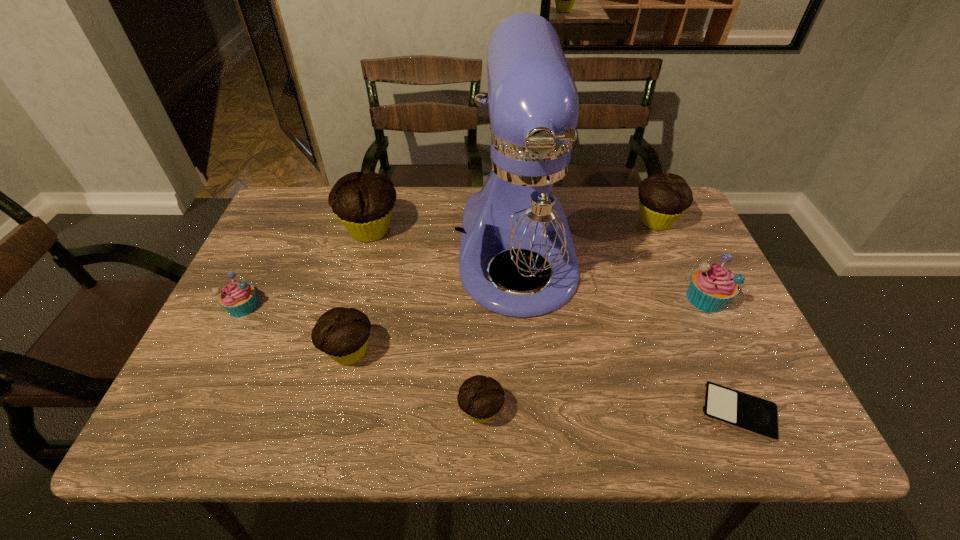
Find the location of a particular element. This screenshot has height=540, width=960. free space between the mixer and the second tallest object is located at coordinates (444, 241).

Select which object is the fifth closest to the tallest muffin. Please provide its 2D coordinates. Your answer should be formatted as a tuple, i.e. [(x, y)], where the tuple contains the x and y coordinates of a point satisfying the conditions above.

[(663, 198)]

At what (x,y) coordinates should I click in order to perform the action: click on object that ranks as the fourth closest to the blue mixer. Please return your answer as a coordinate pair (x, y). Looking at the image, I should click on (663, 198).

You are a GUI agent. You are given a task and a screenshot of the screen. Output one action in this format:
    pyautogui.click(x=<x>, y=<y>)
    Task: Click on the muffin that can be found as the third closest to the seventh shortest object
    The image size is (960, 540).
    Given the screenshot: What is the action you would take?
    pyautogui.click(x=481, y=398)

Locate which muffin ranks second in proximity to the fifth shortest muffin. Please provide its 2D coordinates. Your answer should be formatted as a tuple, i.e. [(x, y)], where the tuple contains the x and y coordinates of a point satisfying the conditions above.

[(481, 398)]

Select which chocolate muffin is the closest to the left blue muffin. Please provide its 2D coordinates. Your answer should be formatted as a tuple, i.e. [(x, y)], where the tuple contains the x and y coordinates of a point satisfying the conditions above.

[(342, 333)]

Identify which chocolate muffin is the second nearest to the shortest object. Please provide its 2D coordinates. Your answer should be formatted as a tuple, i.e. [(x, y)], where the tuple contains the x and y coordinates of a point satisfying the conditions above.

[(663, 198)]

The width and height of the screenshot is (960, 540). I want to click on free space that satisfies the following two spatial constraints: 1. at the mixing area of the mixer; 2. on the right side of the right blue muffin, so [x=521, y=298].